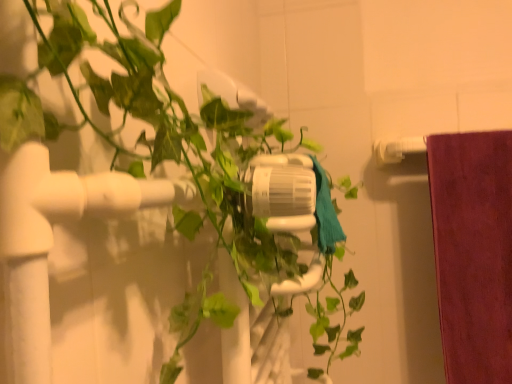
Question: Does teal fabric towel at center have a lesser height compared to green matte plant at center?

Choices:
 (A) no
 (B) yes

Answer: (B)

Question: From the image's perspective, is teal fabric towel at center on green matte plant at center?

Choices:
 (A) yes
 (B) no

Answer: (A)

Question: Is teal fabric towel at center positioned with its back to green matte plant at center?

Choices:
 (A) yes
 (B) no

Answer: (A)

Question: Does teal fabric towel at center appear on the right side of green matte plant at center?

Choices:
 (A) yes
 (B) no

Answer: (A)

Question: Would you say teal fabric towel at center is a long distance from green matte plant at center?

Choices:
 (A) yes
 (B) no

Answer: (B)

Question: Can you confirm if teal fabric towel at center is bigger than green matte plant at center?

Choices:
 (A) yes
 (B) no

Answer: (B)

Question: Considering the relative positions of green matte plant at center and teal fabric towel at center in the image provided, is green matte plant at center to the right of teal fabric towel at center from the viewer's perspective?

Choices:
 (A) no
 (B) yes

Answer: (A)

Question: From a real-world perspective, is green matte plant at center located higher than teal fabric towel at center?

Choices:
 (A) no
 (B) yes

Answer: (A)

Question: Could you tell me if green matte plant at center is facing teal fabric towel at center?

Choices:
 (A) yes
 (B) no

Answer: (A)

Question: Is teal fabric towel at center completely or partially inside green matte plant at center?

Choices:
 (A) no
 (B) yes

Answer: (B)

Question: Considering the relative sizes of green matte plant at center and teal fabric towel at center in the image provided, is green matte plant at center shorter than teal fabric towel at center?

Choices:
 (A) no
 (B) yes

Answer: (A)

Question: Is the depth of green matte plant at center greater than that of teal fabric towel at center?

Choices:
 (A) no
 (B) yes

Answer: (A)

Question: Looking at the image, does green matte plant at center seem bigger or smaller compared to teal fabric towel at center?

Choices:
 (A) small
 (B) big

Answer: (B)